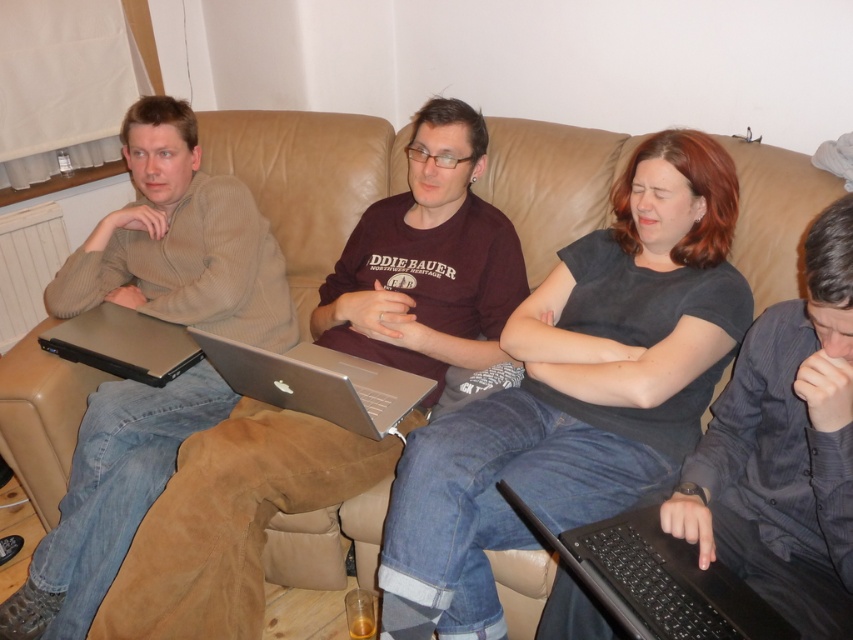
Can you confirm if dark gray matte shirt at center is positioned to the left of black plastic laptop at lower right?

Incorrect, dark gray matte shirt at center is not on the left side of black plastic laptop at lower right.

Can you confirm if dark gray matte shirt at center is smaller than black plastic laptop at lower right?

Actually, dark gray matte shirt at center might be larger than black plastic laptop at lower right.

Who is more distant from viewer, (659,289) or (521,516)?

The point (659,289) is more distant.

The height and width of the screenshot is (640, 853). Find the location of `dark gray matte shirt at center`. dark gray matte shirt at center is located at coordinates point(575,392).

Does silver metallic laptop at center appear under translucent plastic cup at lower center?

Actually, silver metallic laptop at center is above translucent plastic cup at lower center.

Describe the element at coordinates (318, 381) in the screenshot. The width and height of the screenshot is (853, 640). I see `silver metallic laptop at center` at that location.

Describe the element at coordinates (318, 381) in the screenshot. I see `silver metallic laptop at center` at that location.

Image resolution: width=853 pixels, height=640 pixels. Find the location of `silver metallic laptop at center`. silver metallic laptop at center is located at coordinates (318, 381).

This screenshot has height=640, width=853. Identify the location of dark gray matte shirt at center. (575, 392).

Is dark gray matte shirt at center closer to the viewer compared to translucent plastic cup at lower center?

Yes, dark gray matte shirt at center is closer to the viewer.

This screenshot has height=640, width=853. I want to click on dark gray matte shirt at center, so click(x=575, y=392).